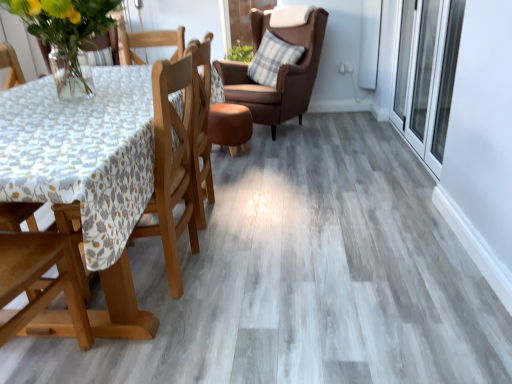
Question: Considering the relative positions of wooden chair at left, which is the 2th chair from top to bottom, and plaid fabric pillow at upper right in the image provided, is wooden chair at left, which is the 2th chair from top to bottom, to the right of plaid fabric pillow at upper right from the viewer's perspective?

Choices:
 (A) yes
 (B) no

Answer: (B)

Question: Does wooden chair at left, the second chair positioned from the back, have a smaller size compared to plaid fabric pillow at upper right?

Choices:
 (A) no
 (B) yes

Answer: (A)

Question: Is wooden chair at left, acting as the first chair starting from the front, completely or partially outside of plaid fabric pillow at upper right?

Choices:
 (A) yes
 (B) no

Answer: (A)

Question: Is wooden chair at left, positioned as the first chair in bottom-to-top order, oriented towards plaid fabric pillow at upper right?

Choices:
 (A) yes
 (B) no

Answer: (B)

Question: Is the surface of wooden chair at left, the second chair positioned from the back, in direct contact with plaid fabric pillow at upper right?

Choices:
 (A) no
 (B) yes

Answer: (A)

Question: Looking at their shapes, would you say plaid fabric pillow at upper right is wider or thinner than translucent glass vase at upper left?

Choices:
 (A) thin
 (B) wide

Answer: (A)

Question: Is plaid fabric pillow at upper right to the left or to the right of translucent glass vase at upper left in the image?

Choices:
 (A) left
 (B) right

Answer: (B)

Question: From a real-world perspective, relative to translucent glass vase at upper left, is plaid fabric pillow at upper right vertically above or below?

Choices:
 (A) above
 (B) below

Answer: (B)

Question: Choose the correct answer: Is plaid fabric pillow at upper right inside translucent glass vase at upper left or outside it?

Choices:
 (A) outside
 (B) inside

Answer: (A)

Question: In terms of width, does transparent glass screen door at right look wider or thinner when compared to translucent glass vase at upper left?

Choices:
 (A) thin
 (B) wide

Answer: (A)

Question: Relative to translucent glass vase at upper left, is transparent glass screen door at right in front or behind?

Choices:
 (A) front
 (B) behind

Answer: (B)

Question: Is transparent glass screen door at right taller or shorter than translucent glass vase at upper left?

Choices:
 (A) tall
 (B) short

Answer: (A)

Question: Is point pyautogui.click(x=456, y=52) positioned closer to the camera than point pyautogui.click(x=2, y=4)?

Choices:
 (A) farther
 (B) closer

Answer: (B)

Question: Is wooden chair at left, acting as the first chair starting from the front, bigger or smaller than translucent glass vase at upper left?

Choices:
 (A) big
 (B) small

Answer: (A)

Question: Would you say wooden chair at left, the second chair positioned from the back, is inside or outside translucent glass vase at upper left?

Choices:
 (A) outside
 (B) inside

Answer: (A)